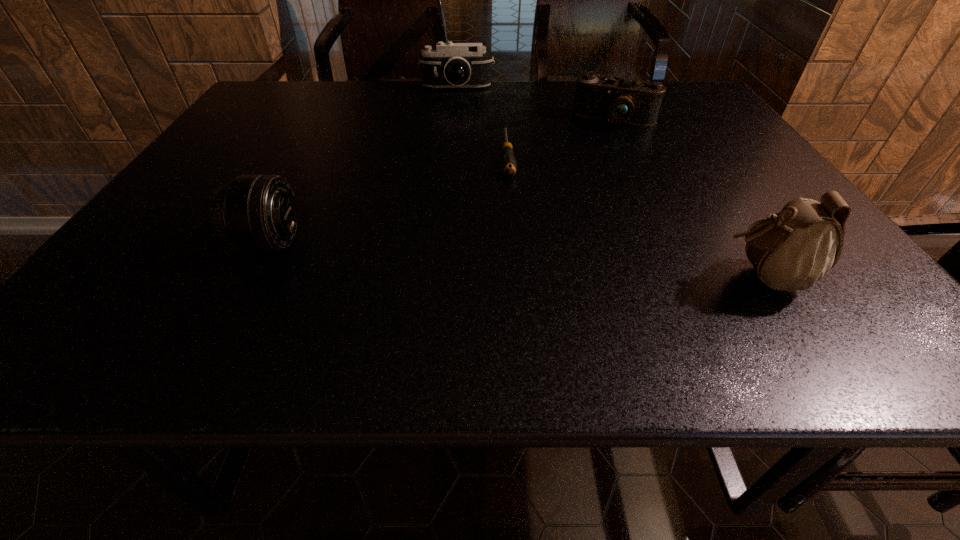
Where is `empty location between the telephoto lens and the pouch`? Image resolution: width=960 pixels, height=540 pixels. empty location between the telephoto lens and the pouch is located at coordinates (516, 260).

Identify the location of free area in between the tallest object and the fourth object from right to left. pyautogui.click(x=610, y=183).

Where is `object that stands as the third closest to the nearer camera`? object that stands as the third closest to the nearer camera is located at coordinates [791, 250].

This screenshot has height=540, width=960. Find the location of `the fourth closest object relative to the tallest object`. the fourth closest object relative to the tallest object is located at coordinates (451, 65).